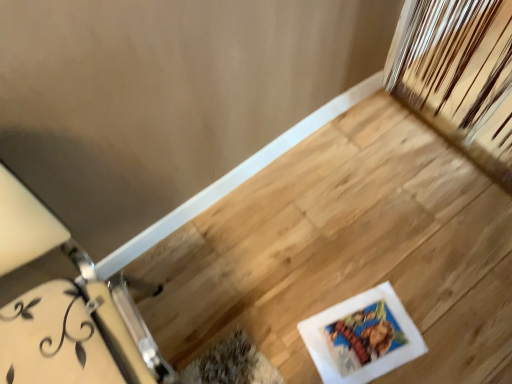
At what (x,y) coordinates should I click in order to perform the action: click on free point below white glossy picture frame at lower right (from a real-world perspective). Please return your answer as a coordinate pair (x, y). This screenshot has width=512, height=384. Looking at the image, I should click on (362, 337).